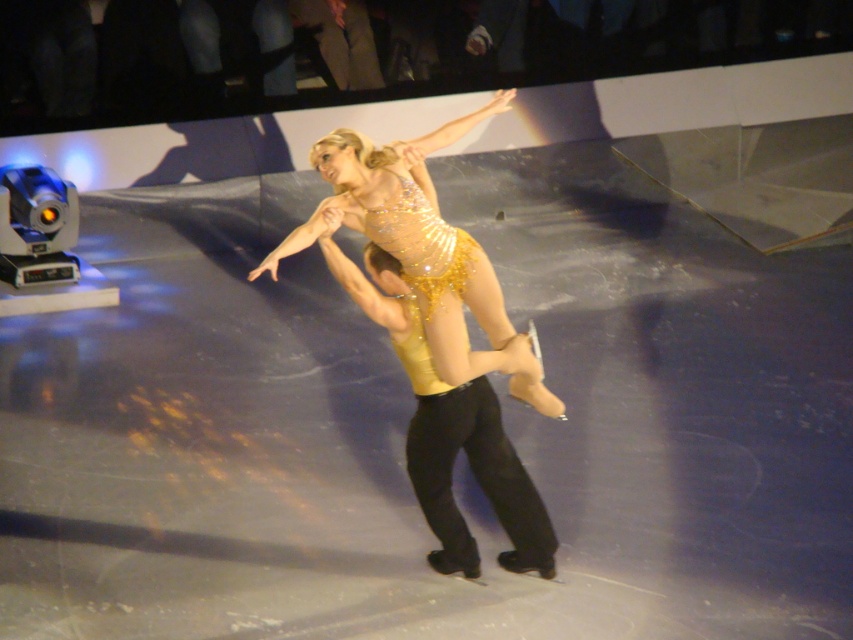
You are a photographer at the edge of the ice rink. You want to capture a photo of both the gold shiny pants at center and the sparkly gold dress at center in the same frame. Which object should you focus on first to ensure both are in focus?

The gold shiny pants at center is closer to you than the sparkly gold dress at center, so you should focus on the gold shiny pants at center first to ensure both are in focus.

You are a photographer standing at the edge of the ice rink. You want to capture a closeup shot of the gold shiny pants at center. The camera you are using has a minimum focusing distance of 3 meters. Will you be able to take the photo without moving closer?

The gold shiny pants at center is 3.70 meters from camera. Since the minimum focusing distance is 3 meters, the camera can focus on the gold shiny pants at center as it is within range.